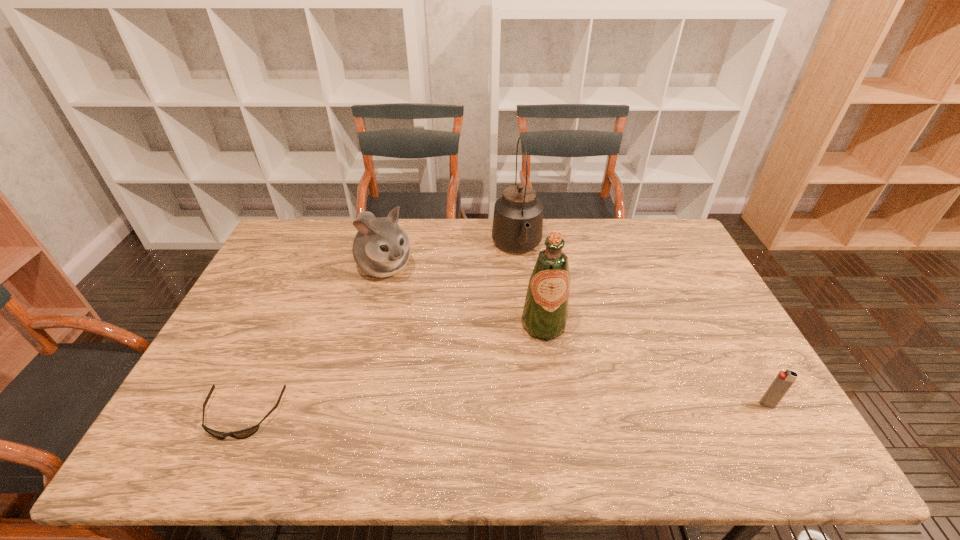
This screenshot has width=960, height=540. I want to click on vacant space on the desktop that is between the shortest object and the igniter and is positioned on the face of the fourth object from right to left, so click(x=521, y=409).

At what (x,y) coordinates should I click in order to perform the action: click on free space on the desktop that is between the shortest object and the igniter and is positioned spout on the kettle. Please return your answer as a coordinate pair (x, y). Looking at the image, I should click on (561, 409).

At what (x,y) coordinates should I click in order to perform the action: click on vacant space on the desktop that is between the shortest object and the rightmost object and is positioned on the front-facing side of the third farthest object. Please return your answer as a coordinate pair (x, y). The image size is (960, 540). Looking at the image, I should click on (564, 408).